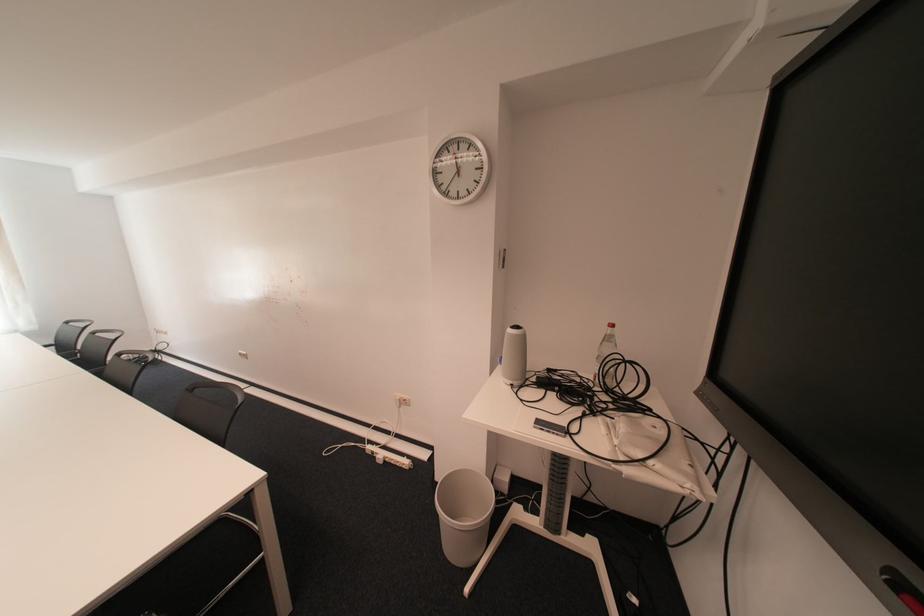
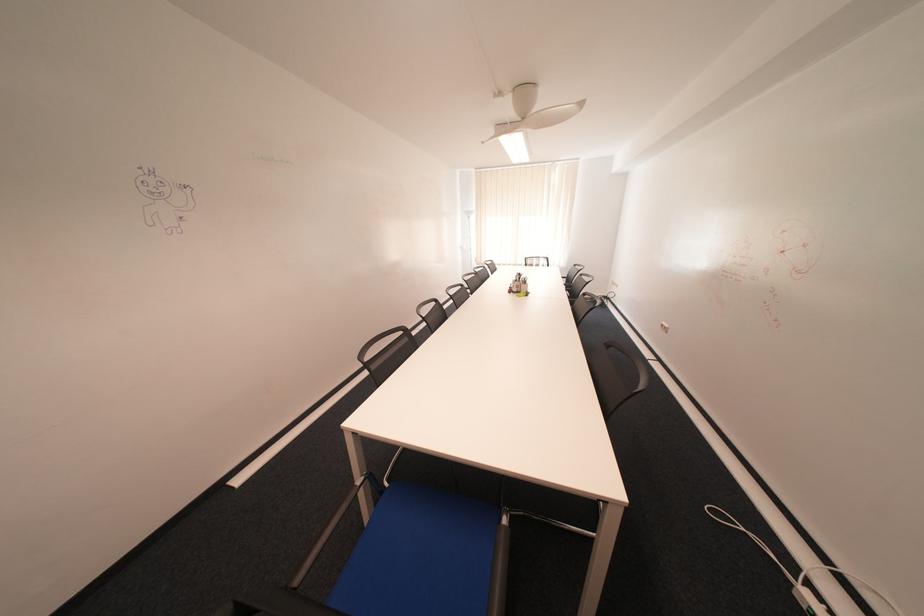
Based on the continuous images, in which direction is the camera rotating?

The camera's rotation is toward left-down.